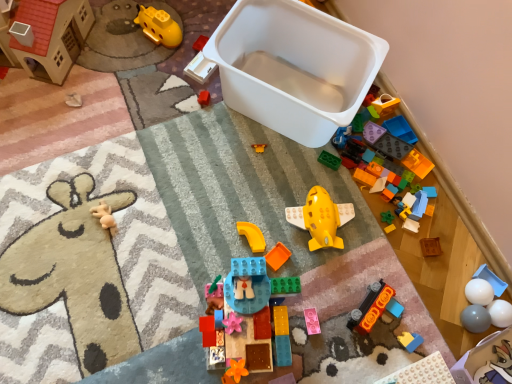
Locate an element on the screen. The image size is (512, 384). vacant area that lies between orange matte car at lower right, marked as the 9th toy in a left-to-right arrangement, and pink matte block at center, the tenth toy positioned from the right is located at coordinates (336, 314).